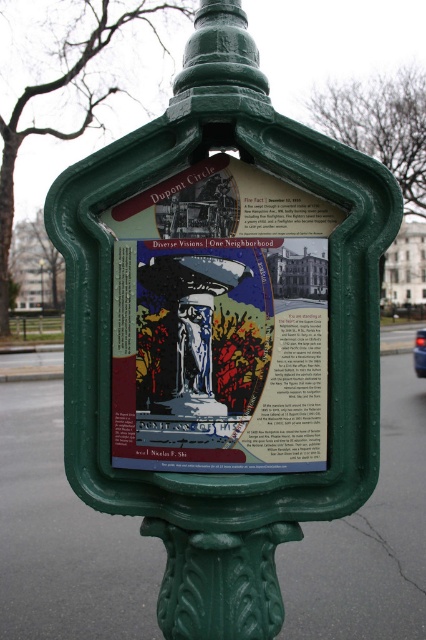
Question: Does matte paper poster at center appear on the right side of green plastic sign at center?

Choices:
 (A) yes
 (B) no

Answer: (A)

Question: Does matte paper poster at center have a smaller size compared to green plastic sign at center?

Choices:
 (A) yes
 (B) no

Answer: (B)

Question: Among these points, which one is farthest from the camera?

Choices:
 (A) (245, 376)
 (B) (39, 259)

Answer: (B)

Question: Is matte paper poster at center closer to the viewer compared to green plastic sign at center?

Choices:
 (A) yes
 (B) no

Answer: (A)